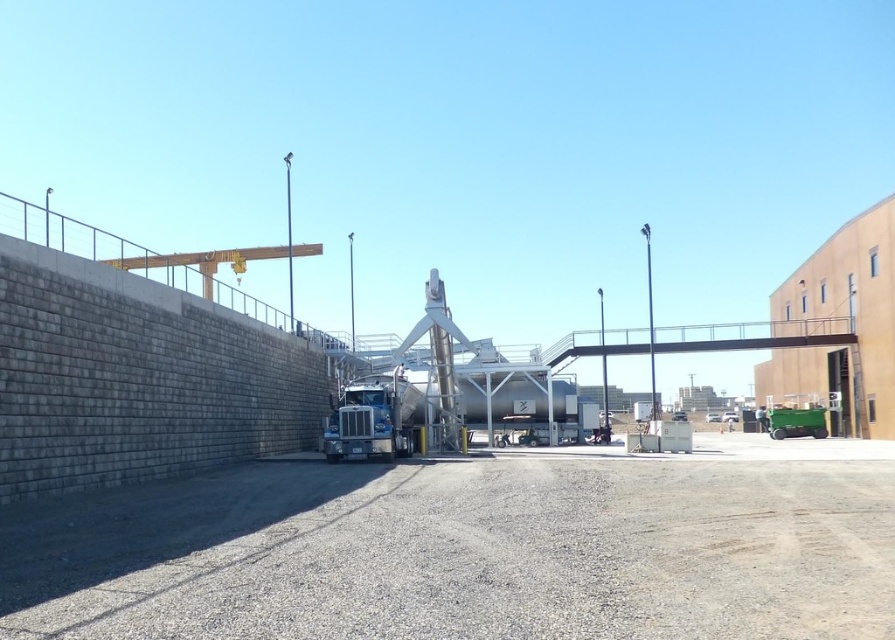
Question: Can you confirm if gray concrete wall at left is wider than silver metallic trailer truck at center?

Choices:
 (A) no
 (B) yes

Answer: (B)

Question: Which object is closer to the camera taking this photo?

Choices:
 (A) gray concrete wall at left
 (B) silver metallic trailer truck at center

Answer: (A)

Question: Can you confirm if gray concrete wall at left is thinner than silver metallic trailer truck at center?

Choices:
 (A) no
 (B) yes

Answer: (A)

Question: Is gray concrete wall at left below silver metallic trailer truck at center?

Choices:
 (A) no
 (B) yes

Answer: (A)